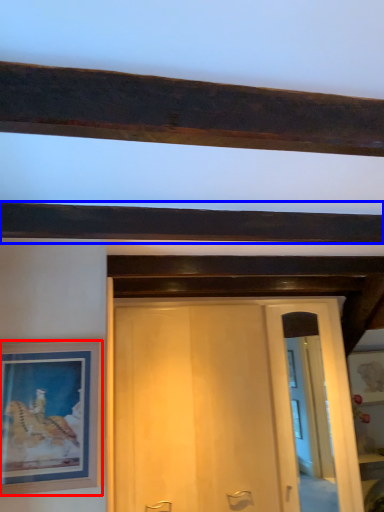
Question: Which object is further to the camera taking this photo, picture frame (highlighted by a red box) or plank (highlighted by a blue box)?

Choices:
 (A) picture frame
 (B) plank

Answer: (A)